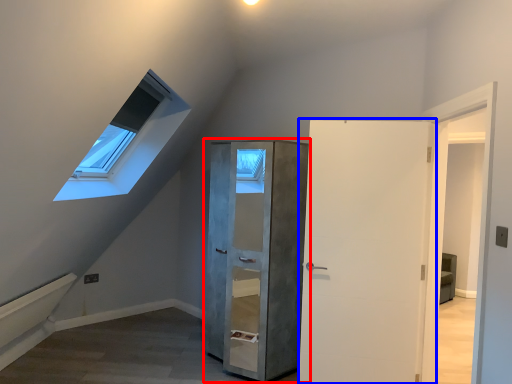
Question: Which of the following is the closest to the observer, cupboard (highlighted by a red box) or door (highlighted by a blue box)?

Choices:
 (A) cupboard
 (B) door

Answer: (B)